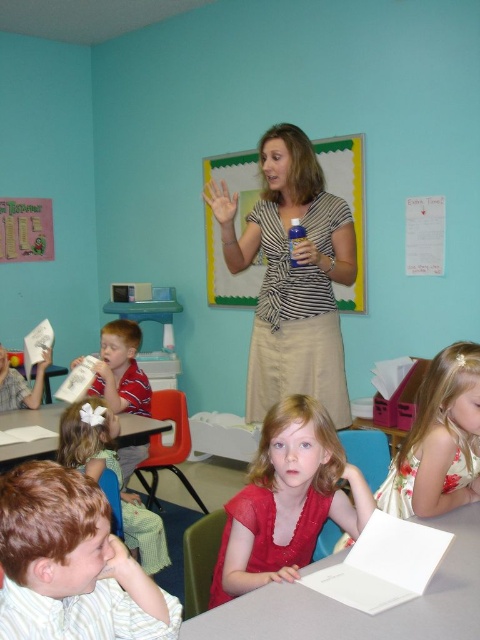
Which is more to the right, light brown hair at center or striped shirt at left?

From the viewer's perspective, light brown hair at center appears more on the right side.

Describe the element at coordinates (115, 474) in the screenshot. I see `light brown hair at center` at that location.

At what (x,y) coordinates should I click in order to perform the action: click on light brown hair at center. Please return your answer as a coordinate pair (x, y). This screenshot has height=640, width=480. Looking at the image, I should click on (115, 474).

Where is `light brown hair at center`? light brown hair at center is located at coordinates (115, 474).

Which is in front, point (296, 285) or point (422, 468)?

Point (422, 468)

Describe the element at coordinates (295, 278) in the screenshot. I see `striped fabric shirt at center` at that location.

Is point (310, 170) closer to viewer compared to point (417, 420)?

That is False.

Find the location of a particular element. striped fabric shirt at center is located at coordinates (295, 278).

Between point (321, 278) and point (127, 346), which one is positioned behind?

The point (127, 346) is more distant.

You are a GUI agent. You are given a task and a screenshot of the screen. Output one action in this format:
    pyautogui.click(x=<x>, y=<y>)
    Task: Click on the striped fabric shirt at center
    This screenshot has height=640, width=480.
    Given the screenshot: What is the action you would take?
    pyautogui.click(x=295, y=278)